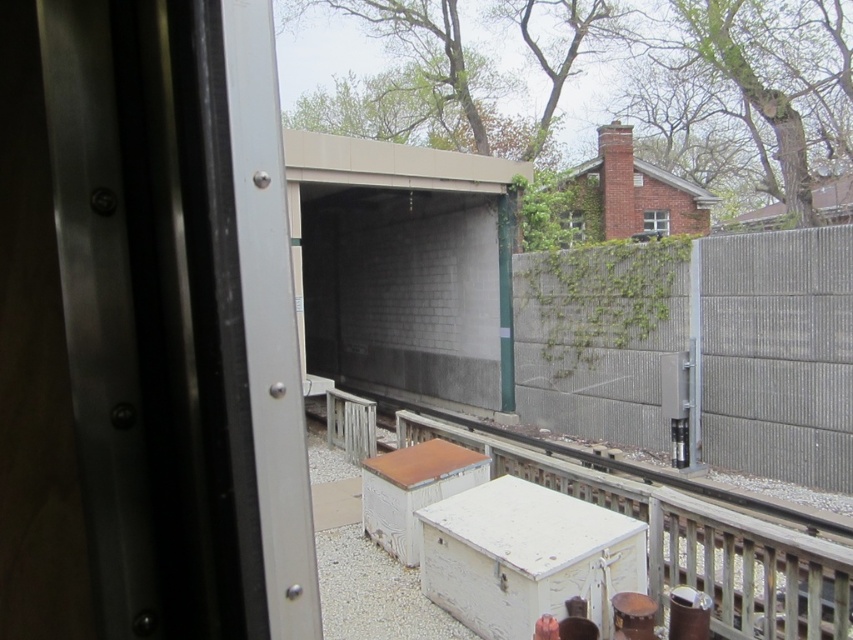
Is gray concrete fence at right thinner than matte glass screen door at center?

Yes.

Can you confirm if gray concrete fence at right is positioned to the left of matte glass screen door at center?

In fact, gray concrete fence at right is to the right of matte glass screen door at center.

Is point (827, 410) closer to camera compared to point (335, 196)?

Yes, point (827, 410) is closer to viewer.

Locate an element on the screen. gray concrete fence at right is located at coordinates (697, 348).

Is point (737, 588) farther from camera compared to point (573, 241)?

No.

From the picture: Who is lower down, white painted wood at center or matte brick window at upper center?

white painted wood at center is below.

Is point (723, 588) behind point (569, 218)?

No, (723, 588) is in front of (569, 218).

Locate an element on the screen. white painted wood at center is located at coordinates (688, 534).

Does white painted wood at center have a smaller size compared to clear glass window at upper right?

Correct, white painted wood at center occupies less space than clear glass window at upper right.

Identify the location of white painted wood at center. This screenshot has width=853, height=640. pos(688,534).